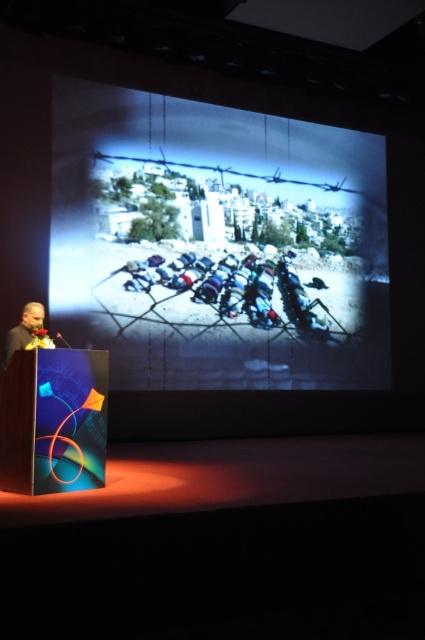
Question: Does matte black screen at center appear over black fabric at left?

Choices:
 (A) no
 (B) yes

Answer: (B)

Question: Which object appears farthest from the camera in this image?

Choices:
 (A) matte black screen at center
 (B) black fabric at left

Answer: (A)

Question: Which point appears farthest from the camera in this image?

Choices:
 (A) (37, 316)
 (B) (118, 269)

Answer: (B)

Question: Among these objects, which one is farthest from the camera?

Choices:
 (A) black fabric at left
 (B) matte black screen at center

Answer: (B)

Question: Observing the image, what is the correct spatial positioning of matte black screen at center in reference to black fabric at left?

Choices:
 (A) above
 (B) below

Answer: (A)

Question: Can you confirm if matte black screen at center is positioned above black fabric at left?

Choices:
 (A) yes
 (B) no

Answer: (A)